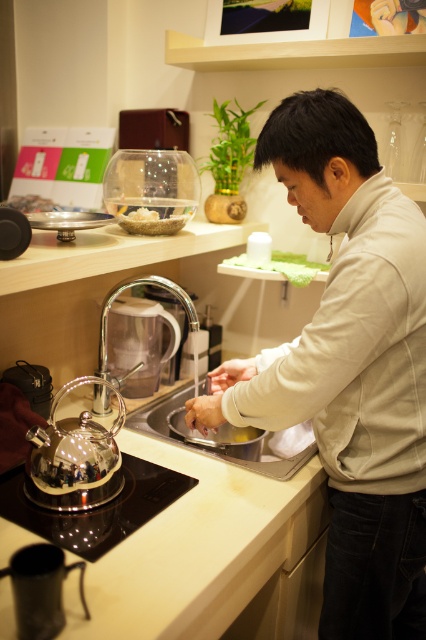
Question: Can you confirm if black glass stove at lower left is positioned below transparent glass teapot at lower left?

Choices:
 (A) no
 (B) yes

Answer: (B)

Question: Among these objects, which one is nearest to the camera?

Choices:
 (A) white matte hand at center
 (B) transparent glass teapot at lower left
 (C) smooth skin hand at sink

Answer: (B)

Question: Which point is farther to the camera?

Choices:
 (A) white glossy sink at center
 (B) white matte bowl at upper left
 (C) black glass stove at lower left

Answer: (B)

Question: From the image, what is the correct spatial relationship of white glossy sink at center in relation to polished chrome faucet at sink left?

Choices:
 (A) below
 (B) above

Answer: (A)

Question: Which point appears closest to the camera in this image?

Choices:
 (A) (54, 429)
 (B) (212, 378)
 (C) (307, 449)

Answer: (A)

Question: Is white matte shirt at center below silver metallic sink at center?

Choices:
 (A) no
 (B) yes

Answer: (A)